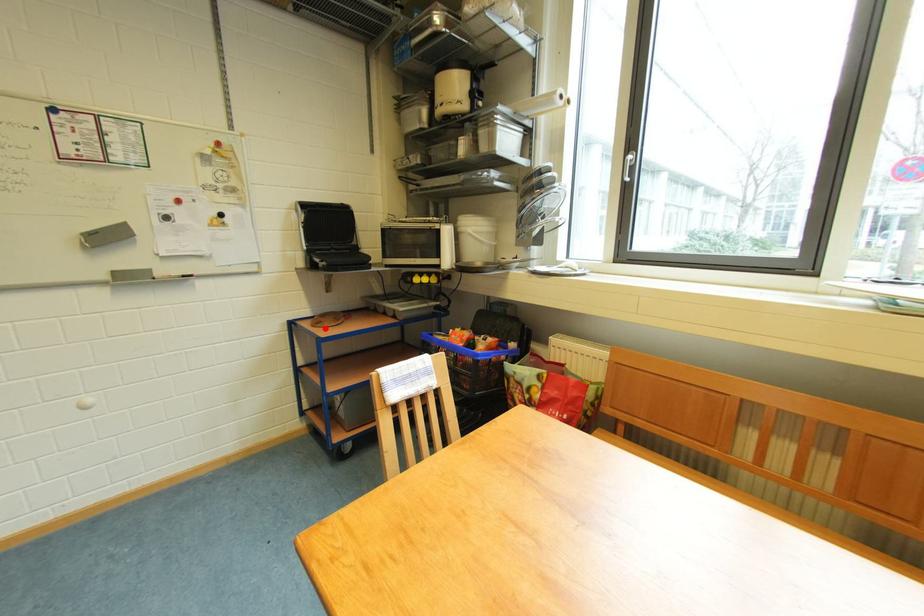
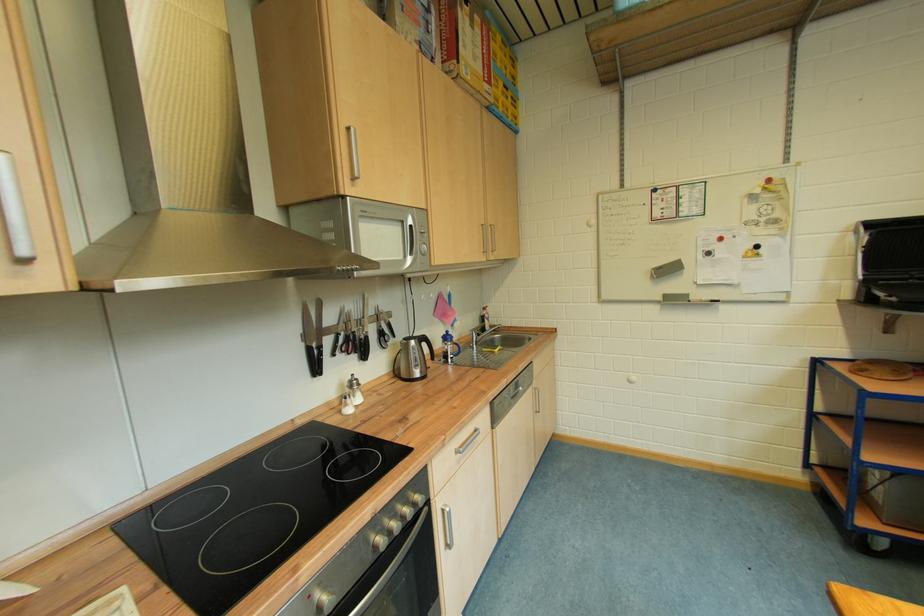
Locate, in the second image, the point that corresponds to the highlighted location in the first image.

(868, 377)